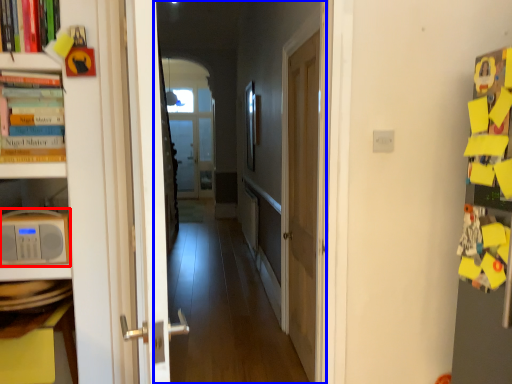
Question: Among these objects, which one is nearest to the camera, appliance (highlighted by a red box) or corridor (highlighted by a blue box)?

Choices:
 (A) appliance
 (B) corridor

Answer: (B)